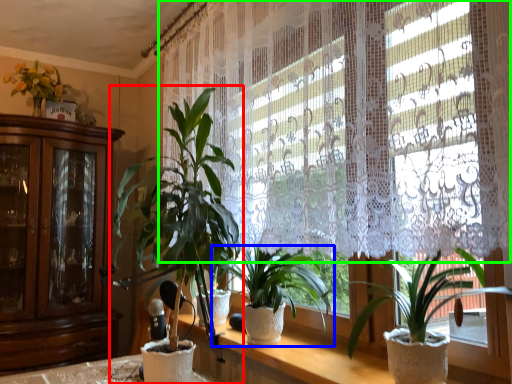
Question: Which object is positioned farthest from houseplant (highlighted by a red box)? Select from houseplant (highlighted by a blue box) and curtain (highlighted by a green box).

Choices:
 (A) houseplant
 (B) curtain

Answer: (B)